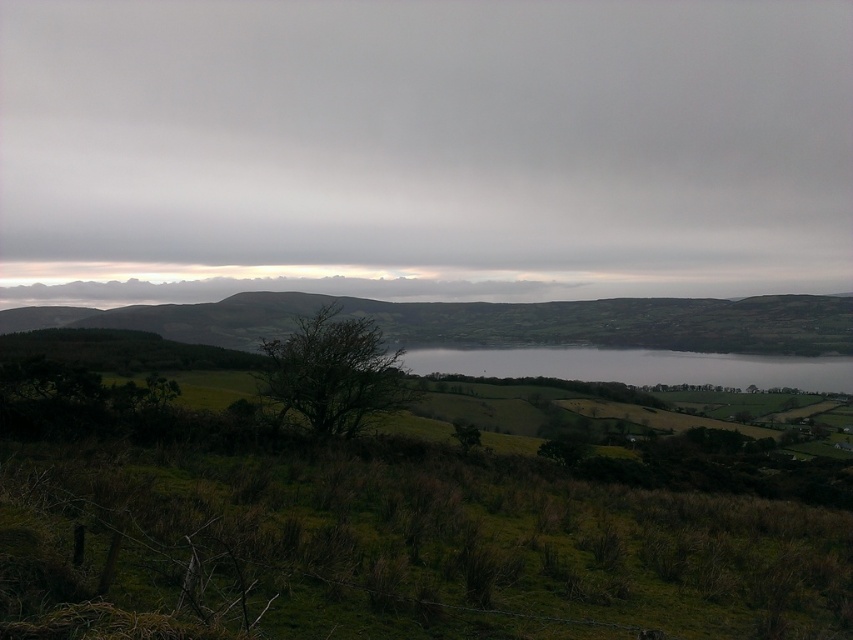
Does point (12, 177) come behind point (482, 314)?

Yes, it is behind point (482, 314).

Measure the distance between gray cloudy sky at upper center and camera.

gray cloudy sky at upper center is 311.85 feet away from camera.

What do you see at coordinates (422, 148) in the screenshot? The image size is (853, 640). I see `gray cloudy sky at upper center` at bounding box center [422, 148].

This screenshot has width=853, height=640. Find the location of `gray cloudy sky at upper center`. gray cloudy sky at upper center is located at coordinates (422, 148).

From the picture: Which of these two, green grassy at lower center or green grassy hillside at lower left, stands shorter?

Standing shorter between the two is green grassy at lower center.

Is green grassy at lower center wider than green grassy hillside at lower left?

No.

What do you see at coordinates (381, 538) in the screenshot? This screenshot has height=640, width=853. I see `green grassy at lower center` at bounding box center [381, 538].

I want to click on green grassy at lower center, so click(381, 538).

Does gray cloudy sky at upper center appear over gray water at center?

Yes, gray cloudy sky at upper center is above gray water at center.

How distant is gray cloudy sky at upper center from gray water at center?

gray cloudy sky at upper center is 48.19 meters away from gray water at center.

Which is behind, point (173, 195) or point (457, 349)?

Point (173, 195)

Find the location of a particular element. This screenshot has height=640, width=853. gray cloudy sky at upper center is located at coordinates (422, 148).